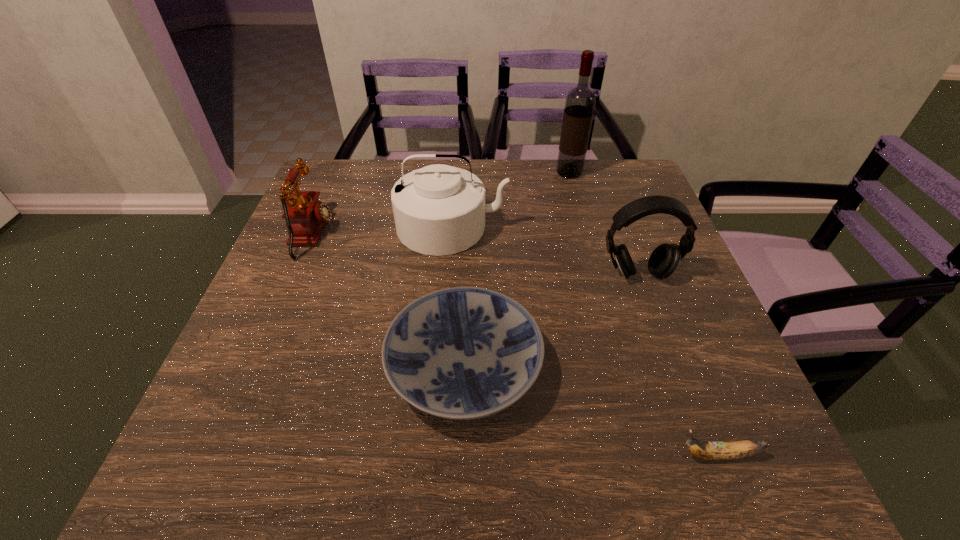
Identify the location of object positioned at the left edge. tap(305, 216).

Where is `earphone situated at the right edge`? The height and width of the screenshot is (540, 960). earphone situated at the right edge is located at coordinates (664, 260).

Find the location of a particular element. banana at the right edge is located at coordinates (738, 449).

The width and height of the screenshot is (960, 540). What are the coordinates of `object located in the near right corner section of the desktop` in the screenshot? It's located at (738, 449).

Locate an element on the screen. vacant area at the far edge of the desktop is located at coordinates (564, 185).

In order to click on vacant space at the near edge in this screenshot , I will do `click(468, 447)`.

You are a GUI agent. You are given a task and a screenshot of the screen. Output one action in this format:
    pyautogui.click(x=<x>, y=<y>)
    Task: Click on the blank area at the left edge
    
    Given the screenshot: What is the action you would take?
    pyautogui.click(x=325, y=282)

This screenshot has width=960, height=540. I want to click on vacant space at the right edge, so click(x=641, y=266).

Image resolution: width=960 pixels, height=540 pixels. Identify the location of vacant region at the far left corner. (352, 204).

You are a GUI agent. You are given a task and a screenshot of the screen. Output one action in this format:
    pyautogui.click(x=<x>, y=<y>)
    Task: Click on the unoccupied area between the nearest object and the kettle
    
    Given the screenshot: What is the action you would take?
    click(x=585, y=341)